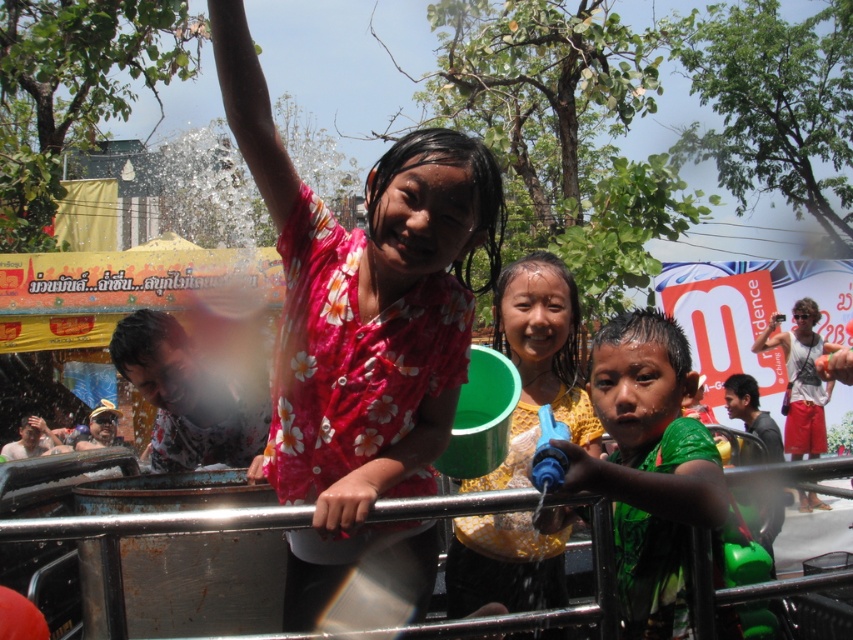
Question: Does floral fabric shirt at center have a smaller size compared to yellow floral shirt at center?

Choices:
 (A) yes
 (B) no

Answer: (B)

Question: Which object is the closest to the white tank top at center?

Choices:
 (A) yellow floral shirt at center
 (B) wet green shirt at center

Answer: (A)

Question: Is floral fabric shirt at center bigger than white tank top at center?

Choices:
 (A) no
 (B) yes

Answer: (B)

Question: Which point appears closest to the camera in this image?

Choices:
 (A) (787, 381)
 (B) (648, 323)
 (C) (511, 518)
 (D) (334, 480)

Answer: (D)

Question: Observing the image, what is the correct spatial positioning of wet green shirt at center in reference to yellow floral shirt at center?

Choices:
 (A) left
 (B) right

Answer: (B)

Question: Which point is farther from the camera taking this photo?

Choices:
 (A) (285, 483)
 (B) (810, 381)
 (C) (679, 456)
 (D) (529, 540)

Answer: (B)